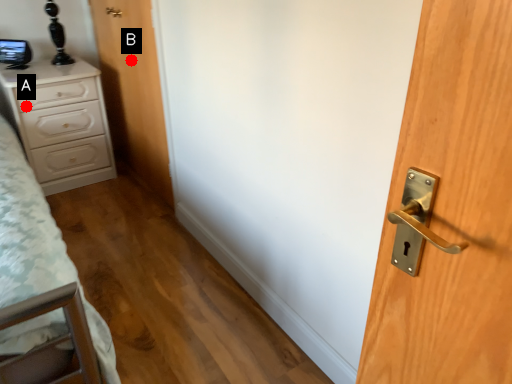
Question: Two points are circled on the image, labeled by A and B beside each circle. Which point appears closest to the camera in this image?

Choices:
 (A) A is closer
 (B) B is closer

Answer: (B)